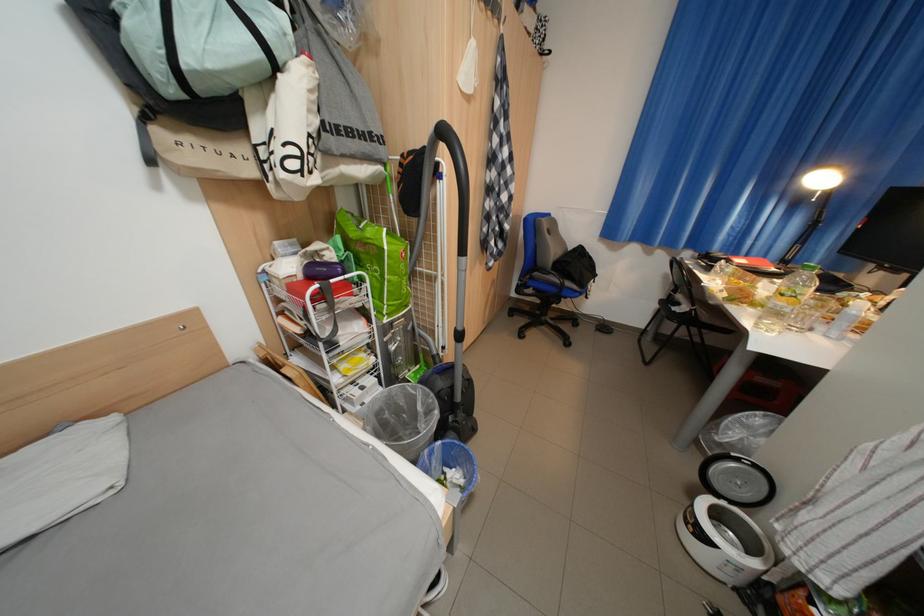
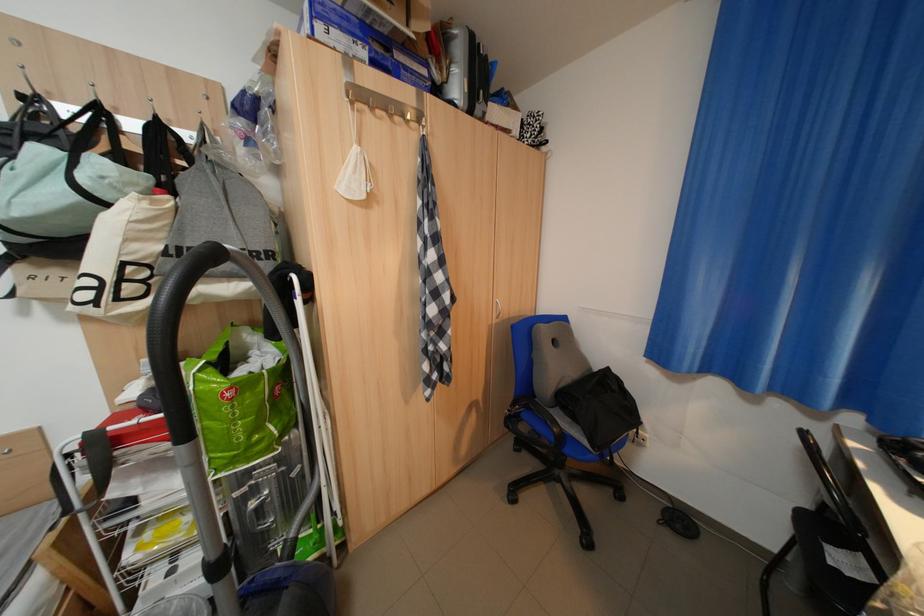
Question: The camera is either moving clockwise (left) or counter-clockwise (right) around the object. The first image is from the beginning of the video and the second image is from the end. Is the camera moving left or right when shooting the video?

Choices:
 (A) Left
 (B) Right

Answer: (B)